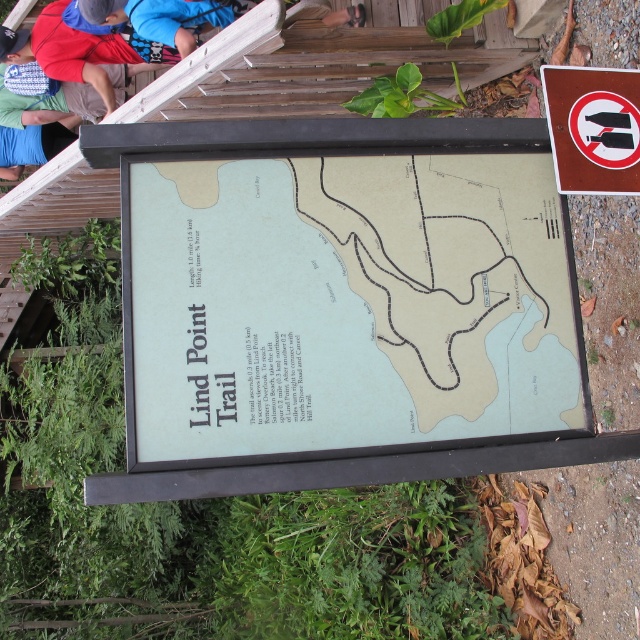
Question: Which point is closer to the camera taking this photo?

Choices:
 (A) (20, 141)
 (B) (310, 280)

Answer: (B)

Question: Estimate the real-world distances between objects in this image. Which object is farther from the blue fabric shirt at upper left?

Choices:
 (A) white plastic sign at upper right
 (B) green paper map at center

Answer: (A)

Question: In this image, where is green paper map at center located relative to blue fabric shirt at upper left?

Choices:
 (A) left
 (B) right

Answer: (B)

Question: Does white plastic sign at upper right lie behind blue fabric shirt at upper left?

Choices:
 (A) no
 (B) yes

Answer: (A)

Question: Which object appears closest to the camera in this image?

Choices:
 (A) green paper map at center
 (B) white plastic sign at upper right
 (C) blue fabric shirt at upper left

Answer: (A)

Question: Is green paper map at center to the left of blue fabric shirt at upper left from the viewer's perspective?

Choices:
 (A) yes
 (B) no

Answer: (B)